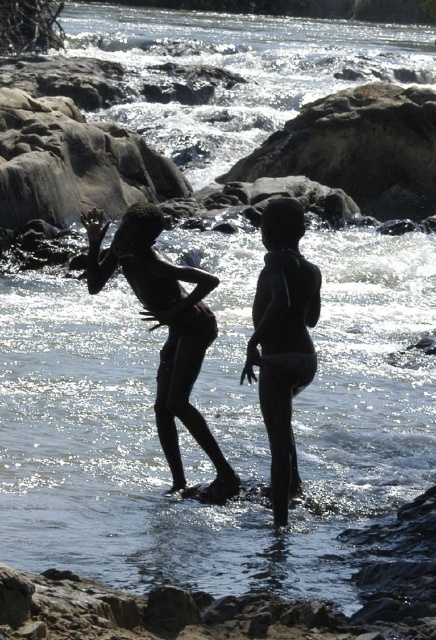
You are a photographer trying to capture the best shot of the scene. You notice a point at coordinates (x=169, y=330). What object is located at this point?

The point at coordinates (x=169, y=330) is on black matte skin at center.

You are a photographer trying to capture the best shot of the two subjects in the water. You notice the black matte skin at center and the black matte swimsuit at center. Which object is located to the left when considering their positions relative to each other?

The black matte skin at center is positioned on the left side of the black matte swimsuit at center, so it is located to the left when considering their positions relative to each other.

You are standing at the riverbank and see two points in the water. The first point is at coordinates point [163,301] and the second is at point [265,256]. Which point is closer to you?

Point [163,301] is closer to the viewer than point [265,256].